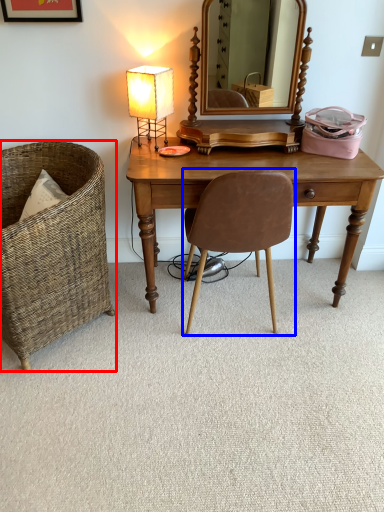
Question: Which point is closer to the camera, chair (highlighted by a red box) or chair (highlighted by a blue box)?

Choices:
 (A) chair
 (B) chair

Answer: (A)